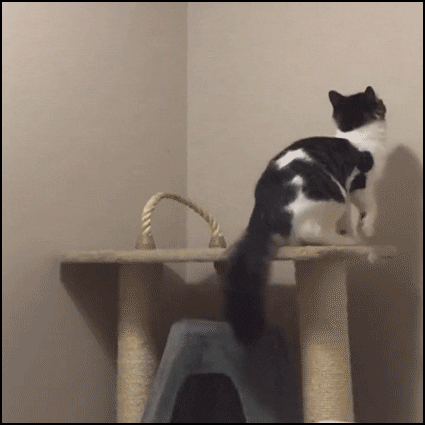
Locate an element on the screen. ceiling is located at coordinates (122, 50).